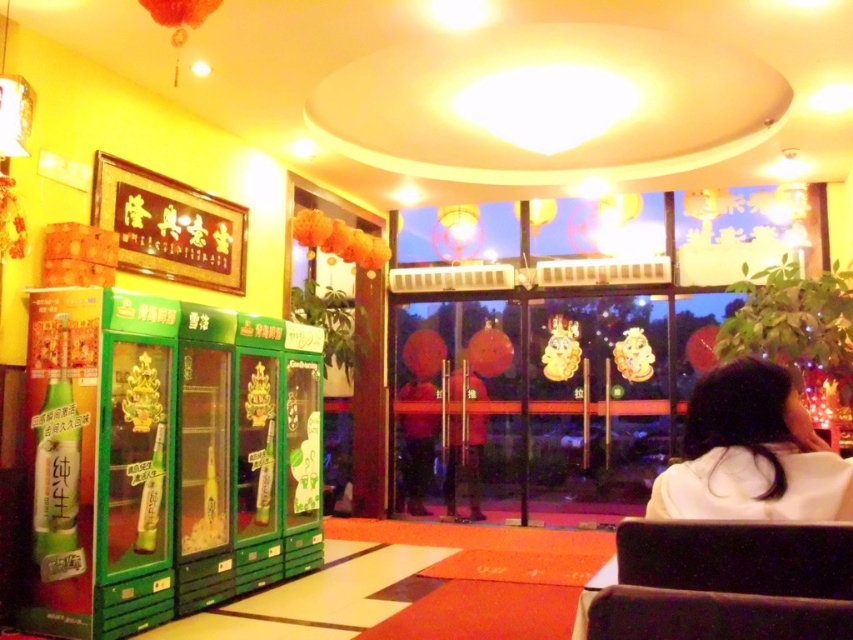
Question: Which of the following is the closest to the observer?

Choices:
 (A) (850, 561)
 (B) (798, 509)

Answer: (A)

Question: Does velvet brown chair at lower right have a smaller size compared to white matte hair at lower right?

Choices:
 (A) yes
 (B) no

Answer: (A)

Question: Which point is closer to the camera?

Choices:
 (A) (631, 572)
 (B) (701, 419)

Answer: (A)

Question: In this image, where is velvet brown chair at lower right located relative to white matte hair at lower right?

Choices:
 (A) above
 (B) below

Answer: (B)

Question: Does velvet brown chair at lower right have a greater width compared to white matte hair at lower right?

Choices:
 (A) no
 (B) yes

Answer: (A)